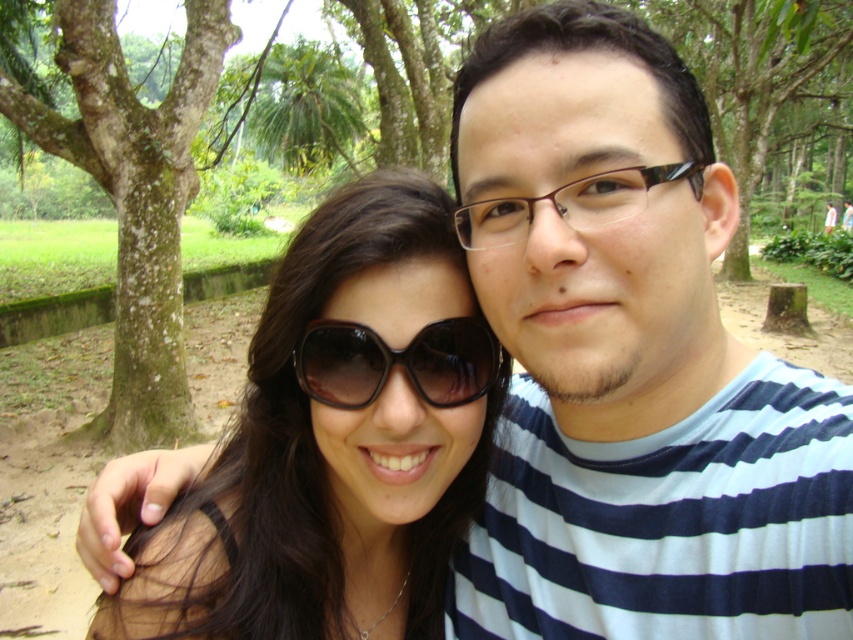
Question: Which point is farther from the camera taking this photo?

Choices:
 (A) (473, 440)
 (B) (606, 214)
 (C) (166, 193)

Answer: (C)

Question: Among these points, which one is farthest from the camera?

Choices:
 (A) (161, 115)
 (B) (315, 352)

Answer: (A)

Question: Does blue striped shirt at center have a larger size compared to black glossy sunglasses at center?

Choices:
 (A) yes
 (B) no

Answer: (A)

Question: Is blue striped shirt at center in front of green mossy tree at center?

Choices:
 (A) yes
 (B) no

Answer: (A)

Question: Among these points, which one is nearest to the camera?

Choices:
 (A) (463, 380)
 (B) (656, 624)
 (C) (225, 13)
 (D) (596, 218)

Answer: (D)

Question: Is green mossy bark tree at left thinner than black glossy sunglasses at center?

Choices:
 (A) no
 (B) yes

Answer: (A)